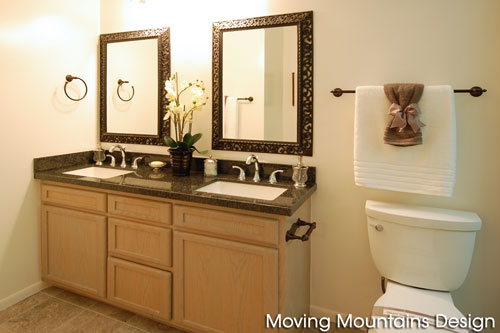
You are a GUI agent. You are given a task and a screenshot of the screen. Output one action in this format:
    pyautogui.click(x=<x>, y=<y>)
    Task: Click on the drawers
    
    Given the screenshot: What is the action you would take?
    pyautogui.click(x=141, y=214), pyautogui.click(x=130, y=232), pyautogui.click(x=125, y=285)